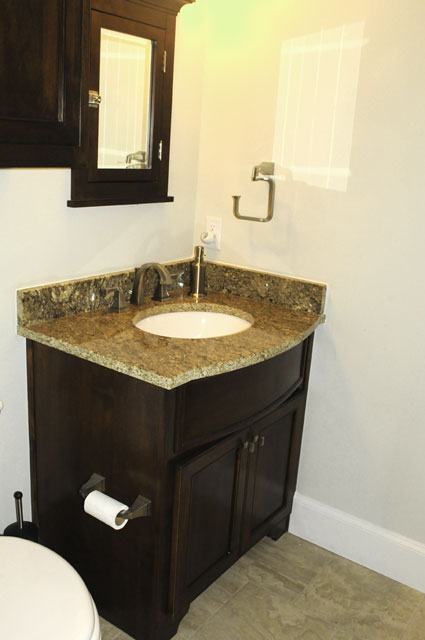
Locate an element on the screen. The image size is (425, 640). tissue is located at coordinates (110, 505).